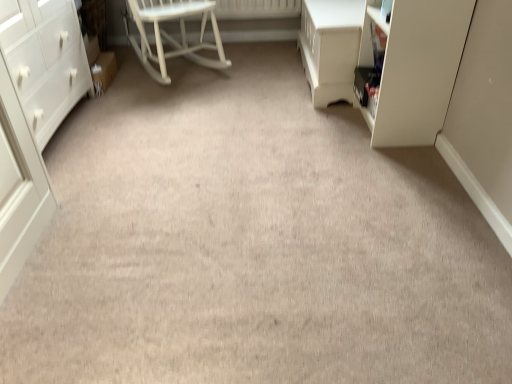
The image size is (512, 384). Find the location of `vacant area to the left of white glossy vanity at upper right`. vacant area to the left of white glossy vanity at upper right is located at coordinates (248, 87).